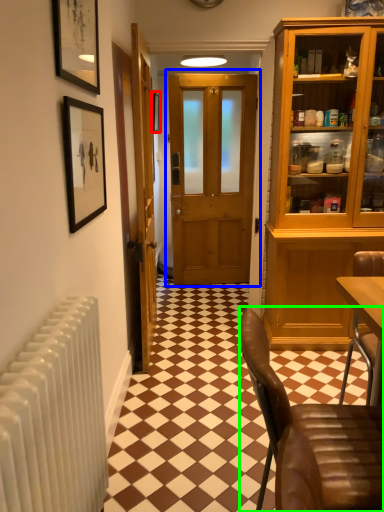
Question: Based on their relative distances, which object is farther from picture frame (highlighted by a red box)? Choose from door (highlighted by a blue box) and chair (highlighted by a green box).

Choices:
 (A) door
 (B) chair

Answer: (B)